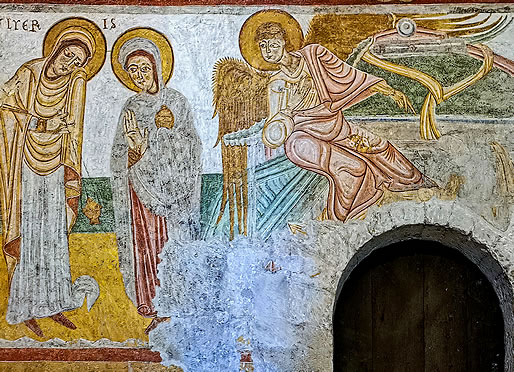
Image resolution: width=514 pixels, height=372 pixels. What are the coordinates of `mural drawing of people on wall` in the screenshot? It's located at (63, 92), (137, 111), (286, 85).